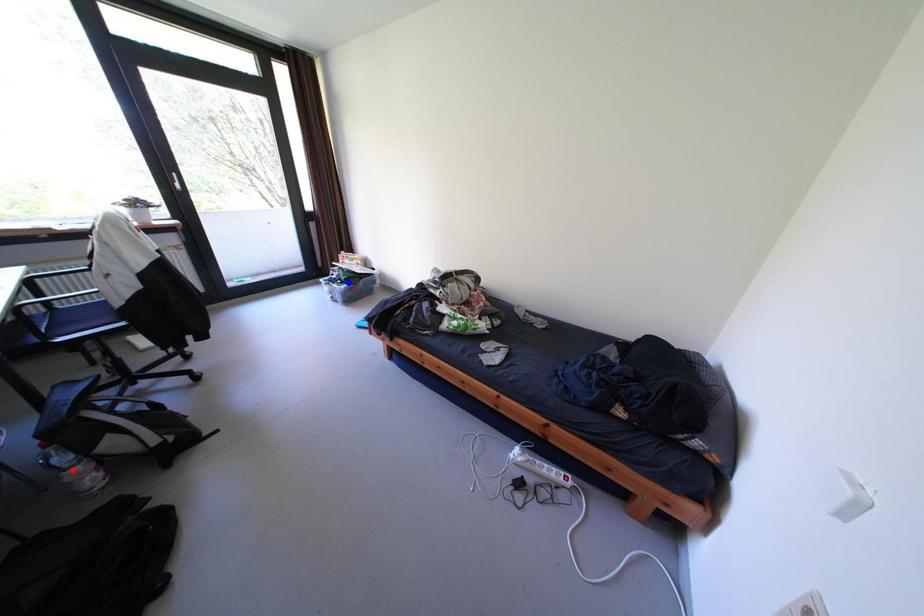
Question: In the image, two points are highlighted. Which point is nearer to the camera? Reply with the corresponding letter.

Choices:
 (A) blue point
 (B) red point

Answer: (B)